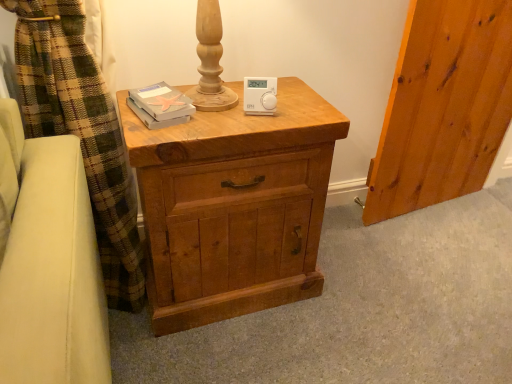
Question: Is white plastic thermostat at center at the back of matte wood chest of drawers at center?

Choices:
 (A) yes
 (B) no

Answer: (B)

Question: Can you confirm if matte wood chest of drawers at center is taller than white plastic thermostat at center?

Choices:
 (A) yes
 (B) no

Answer: (A)

Question: Does matte wood chest of drawers at center appear on the left side of white plastic thermostat at center?

Choices:
 (A) no
 (B) yes

Answer: (B)

Question: Does matte wood chest of drawers at center have a smaller size compared to white plastic thermostat at center?

Choices:
 (A) no
 (B) yes

Answer: (A)

Question: Is white plastic thermostat at center completely or partially inside matte wood chest of drawers at center?

Choices:
 (A) yes
 (B) no

Answer: (B)

Question: Considering the positions of matte gray book at upper left and white plastic thermostat at center in the image, is matte gray book at upper left wider or thinner than white plastic thermostat at center?

Choices:
 (A) wide
 (B) thin

Answer: (A)

Question: In the image, is matte gray book at upper left on the left side or the right side of white plastic thermostat at center?

Choices:
 (A) left
 (B) right

Answer: (A)

Question: Choose the correct answer: Is matte gray book at upper left inside white plastic thermostat at center or outside it?

Choices:
 (A) inside
 (B) outside

Answer: (B)

Question: Does point (170, 100) appear closer or farther from the camera than point (245, 114)?

Choices:
 (A) farther
 (B) closer

Answer: (B)

Question: In terms of width, does white plastic thermostat at center look wider or thinner when compared to matte wood chest of drawers at center?

Choices:
 (A) thin
 (B) wide

Answer: (A)

Question: Considering the positions of point (258, 109) and point (281, 132), is point (258, 109) closer or farther from the camera than point (281, 132)?

Choices:
 (A) closer
 (B) farther

Answer: (B)

Question: Looking at the image, does white plastic thermostat at center seem bigger or smaller compared to matte wood chest of drawers at center?

Choices:
 (A) big
 (B) small

Answer: (B)

Question: In terms of height, does white plastic thermostat at center look taller or shorter compared to matte wood chest of drawers at center?

Choices:
 (A) short
 (B) tall

Answer: (A)

Question: Is matte wood chest of drawers at center bigger or smaller than matte gray book at upper left?

Choices:
 (A) big
 (B) small

Answer: (A)

Question: In the image, is matte wood chest of drawers at center on the left side or the right side of matte gray book at upper left?

Choices:
 (A) right
 (B) left

Answer: (A)